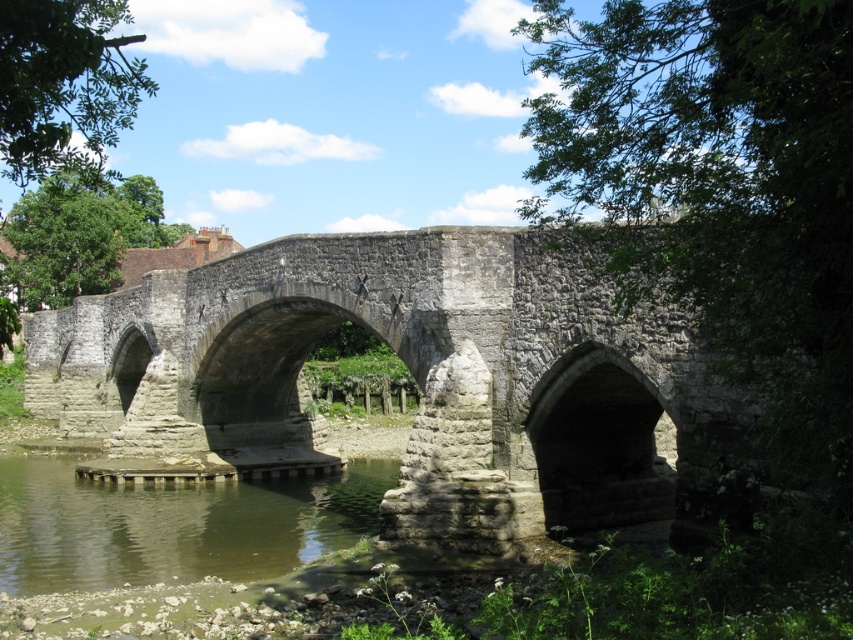
You are a photographer wanting to capture the stone bridge at center and the green murky water at lower left in the same frame. Based on their positions, which object should you adjust your camera to focus on first if you want to include both in your shot?

The stone bridge at center is to the left of green murky water at lower left, so you should focus on the stone bridge at center first to ensure both are in the frame.

From the picture: You are a photographer standing on the stone bridge at center, aiming to capture a photo of the green murky water at lower left. Considering their relative heights, which object should you position lower in your camera frame?

The stone bridge at center is taller than the green murky water at lower left, so you should position the green murky water at lower left lower in your camera frame to account for their height difference.

You are standing on the historic stone bridge and want to take a photo of two points marked on the bridge. The first point is labeled as point (67, 326) and the second is point (305, 525). Which point is closer to you when you are facing the bridge?

Point (67, 326) is closer to you than point (305, 525) because it is further to the viewer.